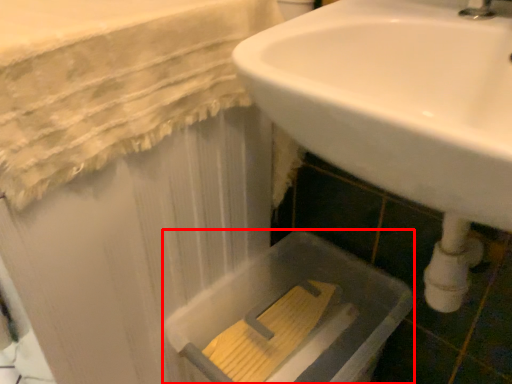
Question: From the image's perspective, where is bath (annotated by the red box) located relative to sink?

Choices:
 (A) below
 (B) above

Answer: (A)